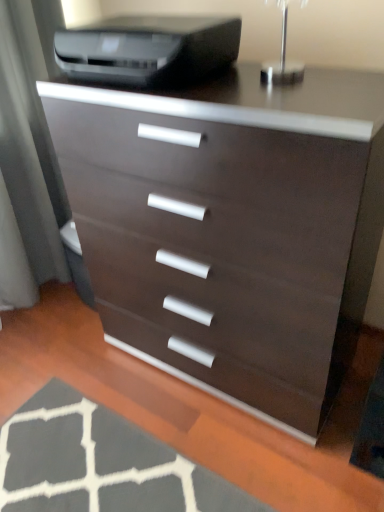
The image size is (384, 512). Identify the location of free space between matte brown chest of drawers at center and dark gray textured rug at lower left. (201, 422).